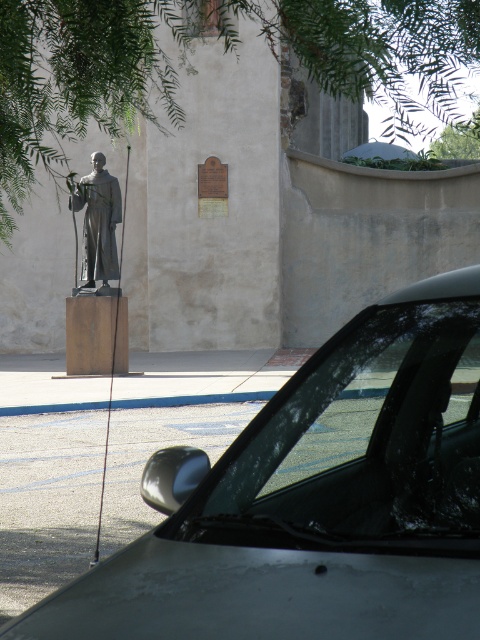
Question: Is silver metallic car at lower left smaller than matte gray statue at left?

Choices:
 (A) yes
 (B) no

Answer: (A)

Question: Which point is farther from the camera taking this photo?

Choices:
 (A) pyautogui.click(x=108, y=236)
 (B) pyautogui.click(x=410, y=422)

Answer: (A)

Question: Based on their relative distances, which object is farther from the transparent glass car window at center?

Choices:
 (A) silver metallic car at lower left
 (B) matte gray statue at left

Answer: (B)

Question: Observing the image, what is the correct spatial positioning of silver metallic car at lower left in reference to transparent glass car window at center?

Choices:
 (A) below
 (B) above

Answer: (A)

Question: Based on their relative distances, which object is nearer to the silver metallic car at lower left?

Choices:
 (A) matte gray statue at left
 (B) transparent glass car window at center

Answer: (B)

Question: Where is transparent glass car window at center located in relation to matte gray statue at left in the image?

Choices:
 (A) left
 (B) right

Answer: (B)